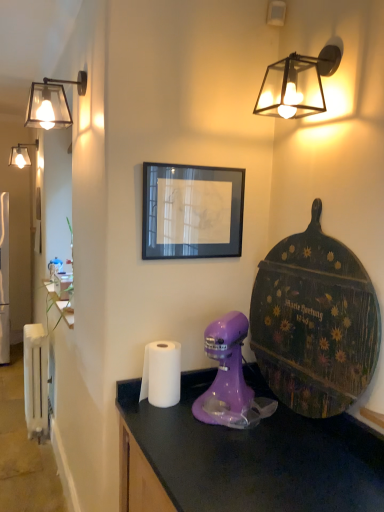
Question: Is black glass picture frame at center turned away from white metallic radiator at left?

Choices:
 (A) yes
 (B) no

Answer: (B)

Question: From a real-world perspective, is black glass picture frame at center over white metallic radiator at left?

Choices:
 (A) yes
 (B) no

Answer: (A)

Question: Does black glass picture frame at center have a lesser height compared to white metallic radiator at left?

Choices:
 (A) yes
 (B) no

Answer: (A)

Question: Does black glass picture frame at center have a lesser width compared to white metallic radiator at left?

Choices:
 (A) no
 (B) yes

Answer: (B)

Question: Is the depth of black glass picture frame at center less than that of white metallic radiator at left?

Choices:
 (A) yes
 (B) no

Answer: (A)

Question: From the image's perspective, is black glass picture frame at center over white metallic radiator at left?

Choices:
 (A) yes
 (B) no

Answer: (A)

Question: From a real-world perspective, is matte purple mixer at center below white paper towel at center?

Choices:
 (A) yes
 (B) no

Answer: (B)

Question: Is white paper towel at center at the back of matte purple mixer at center?

Choices:
 (A) no
 (B) yes

Answer: (A)

Question: Is matte purple mixer at center behind white paper towel at center?

Choices:
 (A) no
 (B) yes

Answer: (A)

Question: Is the position of matte purple mixer at center less distant than that of white paper towel at center?

Choices:
 (A) yes
 (B) no

Answer: (A)

Question: Is matte purple mixer at center wider than white paper towel at center?

Choices:
 (A) no
 (B) yes

Answer: (B)

Question: From the image's perspective, is matte purple mixer at center under white paper towel at center?

Choices:
 (A) no
 (B) yes

Answer: (A)

Question: Considering the relative sizes of matte black glass lamp at upper right, marked as the 1th lamp in a right-to-left arrangement, and matte glass lampshade at upper left, arranged as the second lamp when viewed from the right, in the image provided, is matte black glass lamp at upper right, marked as the 1th lamp in a right-to-left arrangement, shorter than matte glass lampshade at upper left, arranged as the second lamp when viewed from the right,?

Choices:
 (A) no
 (B) yes

Answer: (B)